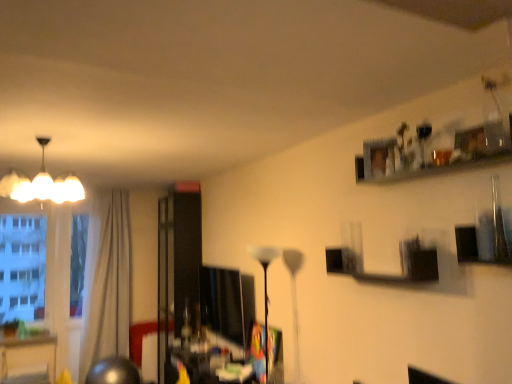
Question: From the image's perspective, relative to white glossy chandelier at upper left, the first lamp when ordered from top to bottom, is transparent glass window at left above or below?

Choices:
 (A) below
 (B) above

Answer: (A)

Question: Does point (23, 251) appear closer or farther from the camera than point (74, 185)?

Choices:
 (A) closer
 (B) farther

Answer: (B)

Question: Which of these objects is positioned closest to the transparent glass door at center?

Choices:
 (A) transparent glass window at left
 (B) matte black monitor at center
 (C) white glossy floor lamp at center, which ranks as the 2th lamp in left-to-right order
 (D) beige fabric curtain at left
 (E) white glossy chandelier at upper left, the 1th lamp in the left-to-right sequence

Answer: (B)

Question: Which of these objects is positioned closest to the transparent glass door at center?

Choices:
 (A) transparent glass window at left
 (B) matte black monitor at center
 (C) white glossy floor lamp at center, which ranks as the 2th lamp in left-to-right order
 (D) beige fabric curtain at left
 (E) white glossy chandelier at upper left, the second lamp from the right

Answer: (B)